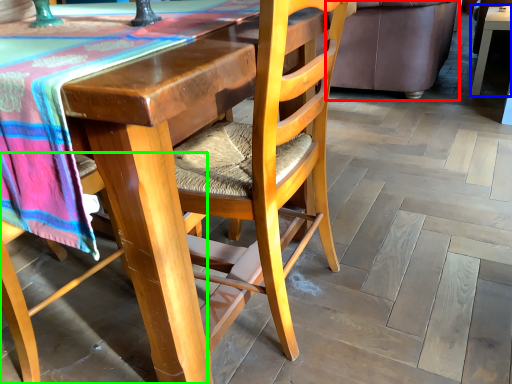
Question: Estimate the real-world distances between objects in this image. Which object is farther from couch (highlighted by a red box), table (highlighted by a blue box) or chair (highlighted by a green box)?

Choices:
 (A) table
 (B) chair

Answer: (B)